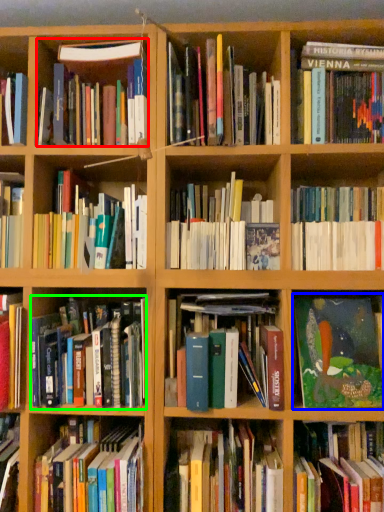
Question: Estimate the real-world distances between objects in this image. Which object is closer to book (highlighted by a red box), book (highlighted by a blue box) or book (highlighted by a green box)?

Choices:
 (A) book
 (B) book

Answer: (B)